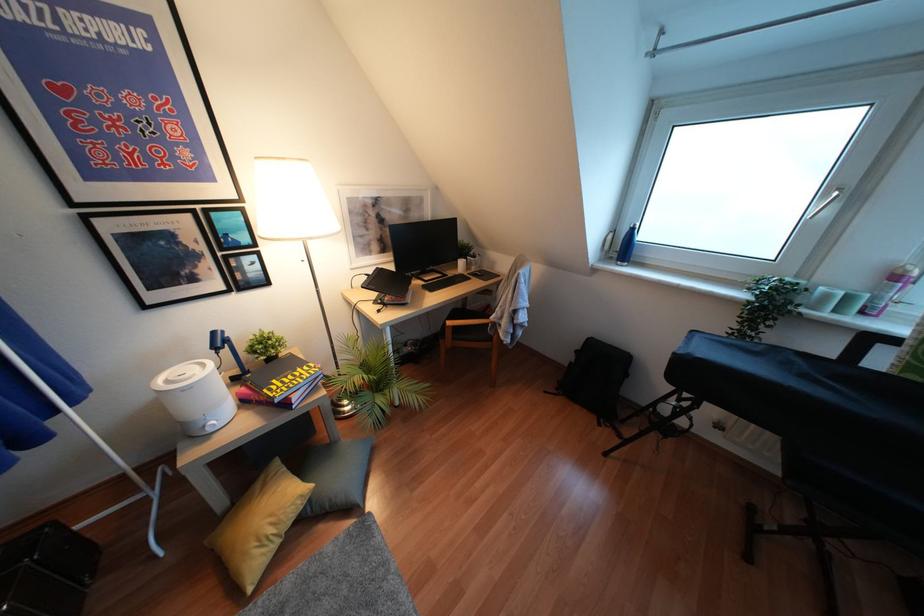
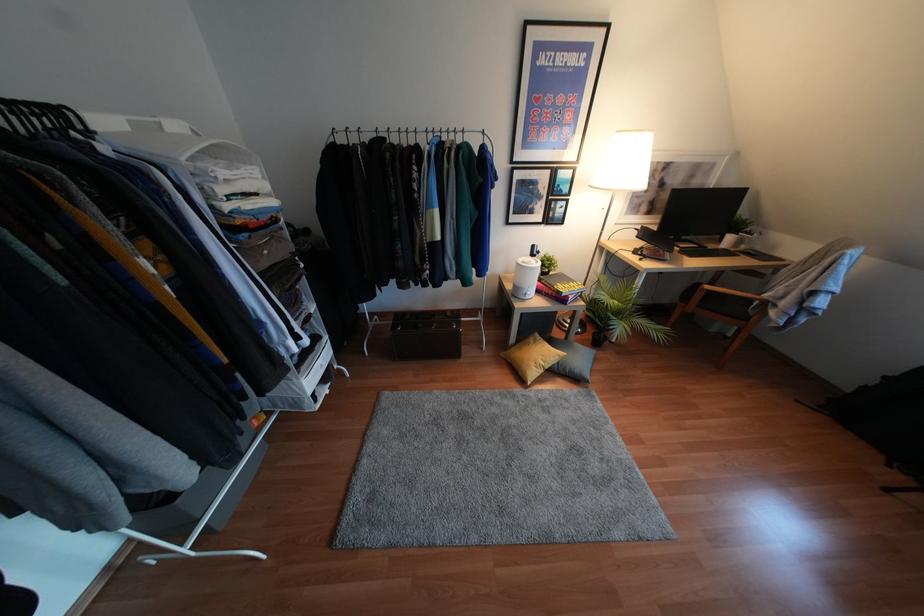
Locate, in the second image, the point that corresponds to [448,322] in the first image.

(707, 286)